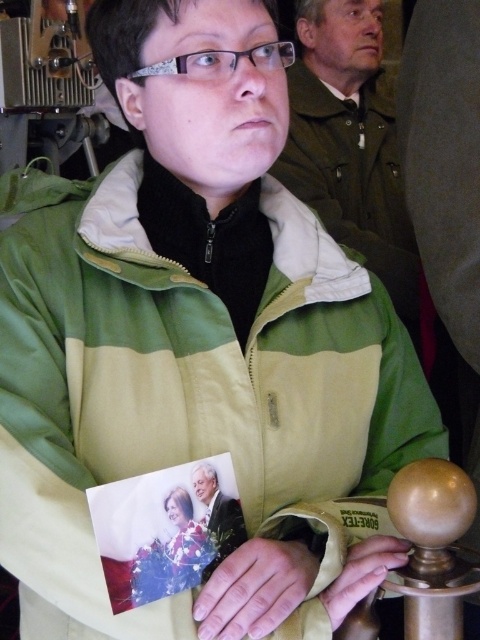
Based on the photo, can you confirm if green/yellow nylon jacket at center is wider than matte gold handle at lower center?

Yes.

Can you confirm if green/yellow nylon jacket at center is taller than matte gold handle at lower center?

Yes, green/yellow nylon jacket at center is taller than matte gold handle at lower center.

What do you see at coordinates (188, 394) in the screenshot? The image size is (480, 640). I see `green/yellow nylon jacket at center` at bounding box center [188, 394].

At what (x,y) coordinates should I click in order to perform the action: click on green/yellow nylon jacket at center. Please return your answer as a coordinate pair (x, y). The height and width of the screenshot is (640, 480). Looking at the image, I should click on (x=188, y=394).

Is green/yellow nylon jacket at center taller than green matte jacket at upper center?

No, green/yellow nylon jacket at center is not taller than green matte jacket at upper center.

Is green/yellow nylon jacket at center shorter than green matte jacket at upper center?

Indeed, green/yellow nylon jacket at center has a lesser height compared to green matte jacket at upper center.

Does point (428, 428) come closer to viewer compared to point (340, 216)?

That is True.

Where is `green/yellow nylon jacket at center`? The image size is (480, 640). green/yellow nylon jacket at center is located at coordinates (188, 394).

Is green/yellow nylon jacket at center below smooth skin hand at center?

Actually, green/yellow nylon jacket at center is above smooth skin hand at center.

Does green/yellow nylon jacket at center appear over smooth skin hand at center?

Correct, green/yellow nylon jacket at center is located above smooth skin hand at center.

What do you see at coordinates (188, 394) in the screenshot? Image resolution: width=480 pixels, height=640 pixels. I see `green/yellow nylon jacket at center` at bounding box center [188, 394].

Locate an element on the screen. green/yellow nylon jacket at center is located at coordinates (188, 394).